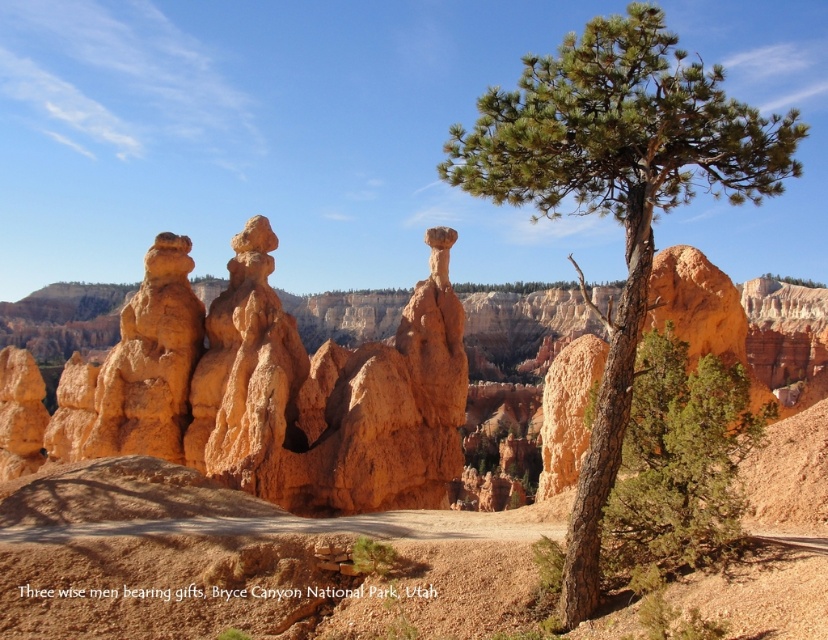
Question: Can you confirm if orange sandstone hoodoo at center is positioned below green textured tree at center?

Choices:
 (A) no
 (B) yes

Answer: (B)

Question: Can you confirm if orange sandstone hoodoo at center is wider than green rough bark tree at center?

Choices:
 (A) no
 (B) yes

Answer: (A)

Question: Which point is farther to the camera?

Choices:
 (A) green textured tree at center
 (B) green rough bark tree at center
 (C) orange sandstone hoodoo at center

Answer: (C)

Question: Which of these objects is positioned closest to the green rough bark tree at center?

Choices:
 (A) green textured tree at center
 (B) orange sandstone hoodoo at center

Answer: (A)

Question: Is orange sandstone hoodoo at center below green textured tree at center?

Choices:
 (A) no
 (B) yes

Answer: (B)

Question: Estimate the real-world distances between objects in this image. Which object is farther from the green textured tree at center?

Choices:
 (A) green rough bark tree at center
 (B) orange sandstone hoodoo at center

Answer: (B)